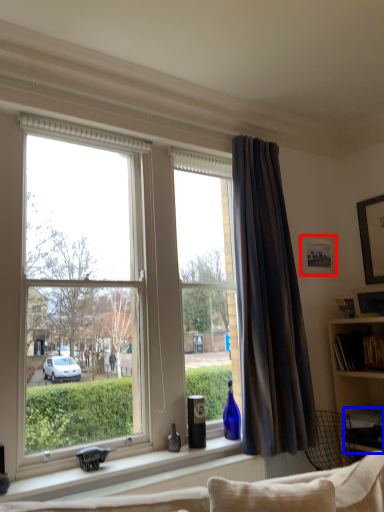
Question: Which of the following is the closest to the observer, picture frame (highlighted by a red box) or desk (highlighted by a blue box)?

Choices:
 (A) picture frame
 (B) desk

Answer: (B)